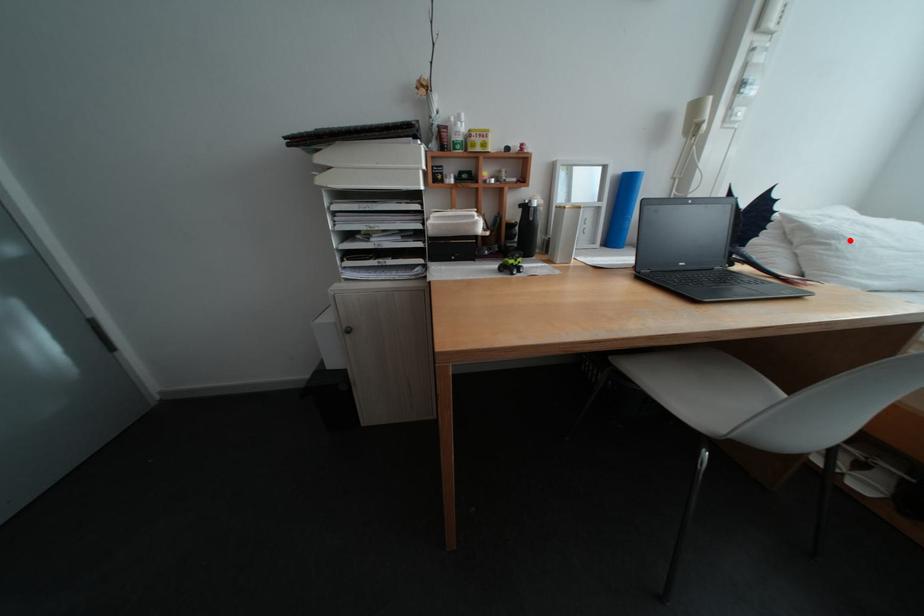
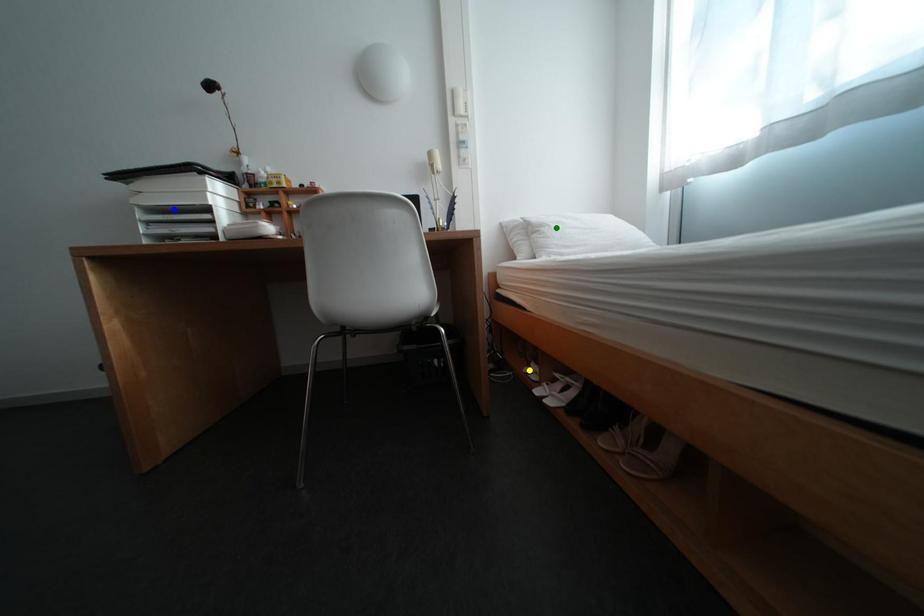
Question: I am providing you with two images of the same scene from different viewpoints. A red point is marked on the first image. You are given multiple points on the second image. Which point in image 2 represents the same 3d spot as the red point in image 1?

Choices:
 (A) blue point
 (B) green point
 (C) yellow point

Answer: (B)